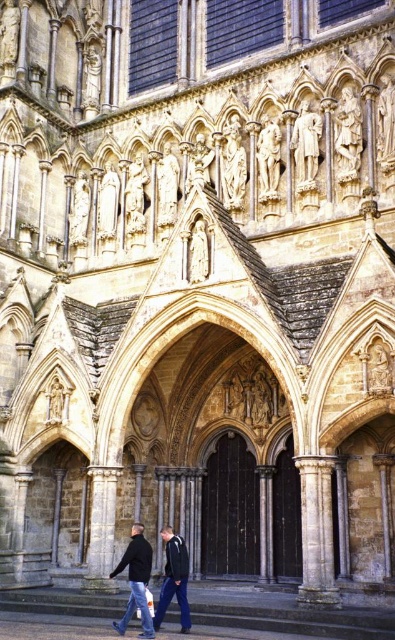
Question: Considering the relative positions of dark blue jacket at center and stone statue at center in the image provided, where is dark blue jacket at center located with respect to stone statue at center?

Choices:
 (A) above
 (B) below

Answer: (B)

Question: Estimate the real-world distances between objects in this image. Which object is closer to the dark blue jacket at center?

Choices:
 (A) dark gray jacket at center
 (B) stone statue at center

Answer: (A)

Question: Which point is closer to the camera?

Choices:
 (A) dark gray jacket at center
 (B) stone statue at center

Answer: (A)

Question: Among these objects, which one is farthest from the camera?

Choices:
 (A) dark blue jacket at center
 (B) stone statue at center
 (C) dark gray jacket at center

Answer: (B)

Question: Is dark gray jacket at center to the right of dark blue jacket at center from the viewer's perspective?

Choices:
 (A) yes
 (B) no

Answer: (B)

Question: Can you confirm if dark gray jacket at center is wider than dark blue jacket at center?

Choices:
 (A) no
 (B) yes

Answer: (B)